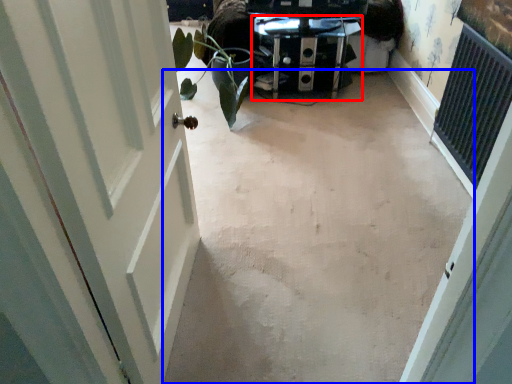
Question: Among these objects, which one is farthest to the camera, furniture (highlighted by a red box) or concrete (highlighted by a blue box)?

Choices:
 (A) furniture
 (B) concrete

Answer: (A)